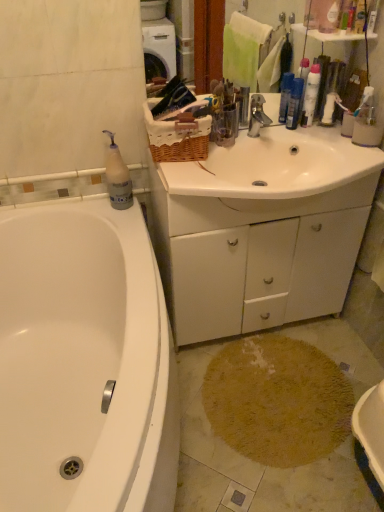
This screenshot has height=512, width=384. I want to click on vacant area that lies to the right of metallic silver faucet at center, so click(285, 146).